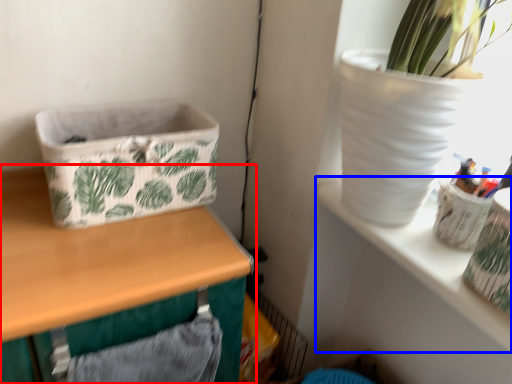
Question: Among these objects, which one is nearest to the camera, table (highlighted by a red box) or shelf (highlighted by a blue box)?

Choices:
 (A) table
 (B) shelf

Answer: (A)